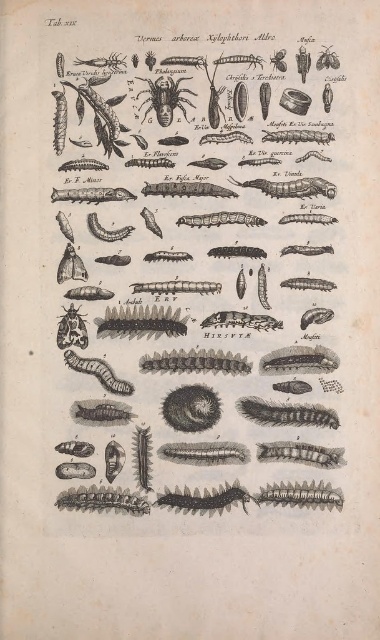
You are examining the botanical illustration labeled Tab. xix. You notice two points marked at coordinates point (302, 452) and point (294, 422). From your perspective as an observer, which point appears closer to you?

Point (302, 452) is closer to the camera than point (294, 422), so the point (302, 452) appears closer to you.